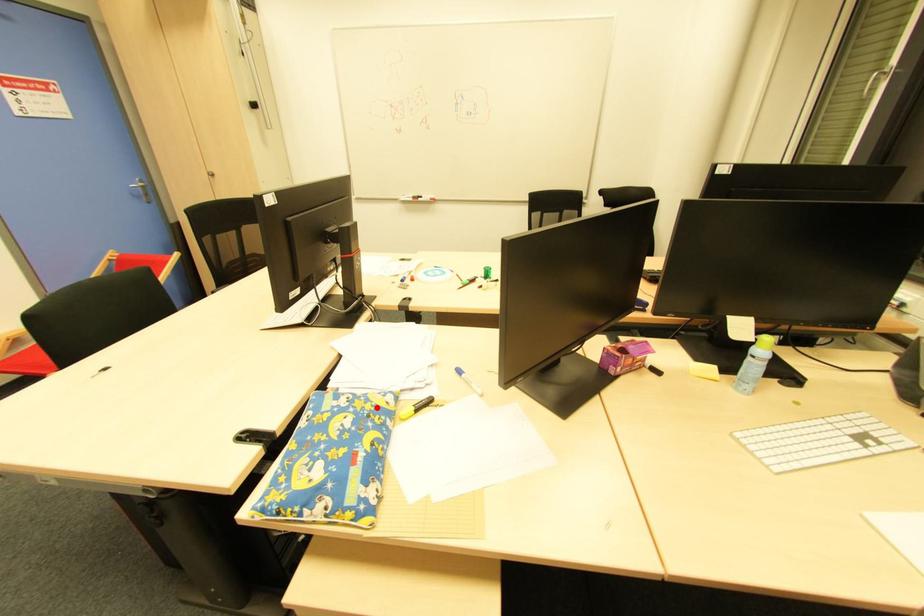
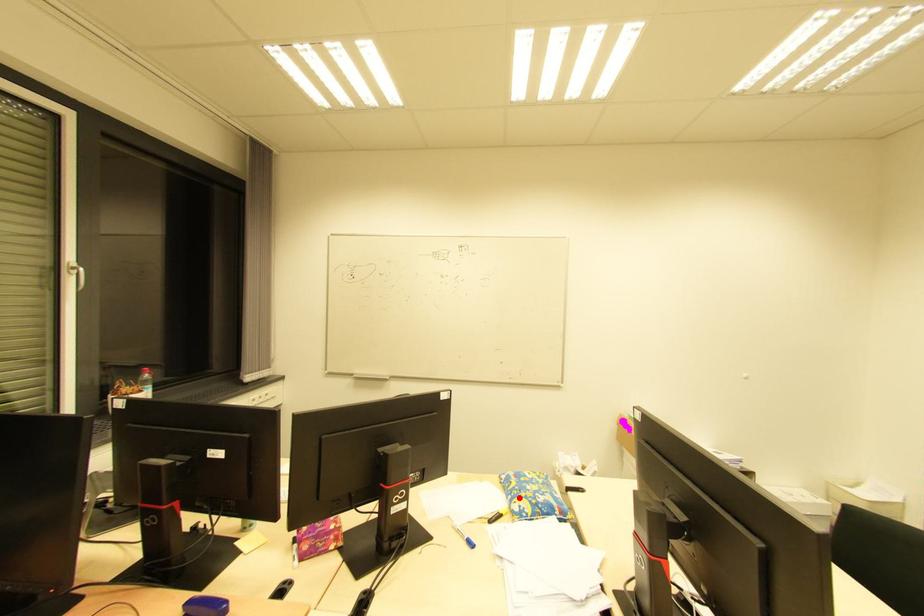
I am providing you with two images of the same scene from different viewpoints. A red point is marked on the first image and another point is marked on the second image. Is the red point in image1 aligned with the point shown in image2?

Yes